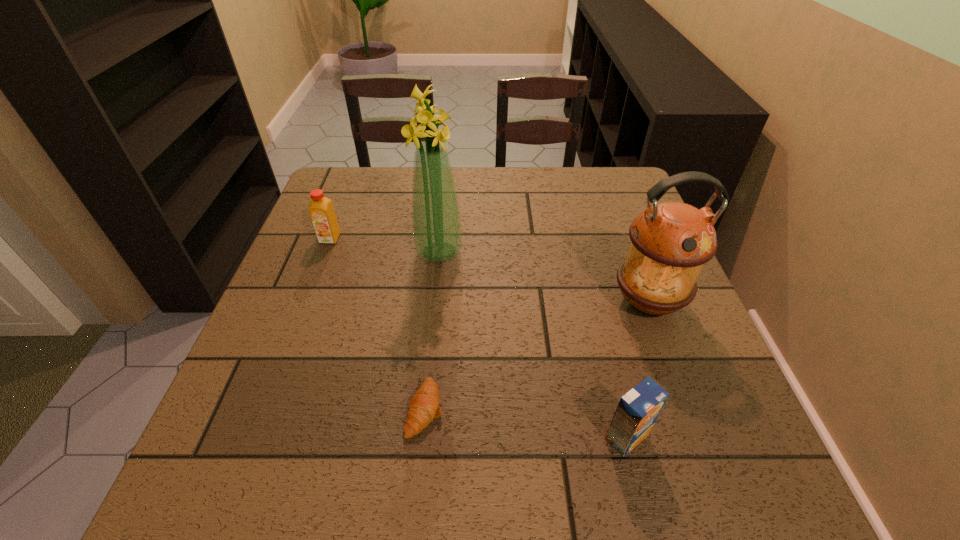
This screenshot has height=540, width=960. In the image, there is a desktop. Identify the location of vacant space at the far right corner. (613, 177).

Where is `free space between the crescent roll and the left orange_juice`? Image resolution: width=960 pixels, height=540 pixels. free space between the crescent roll and the left orange_juice is located at coordinates (377, 324).

Where is `vacant space in between the tallest object and the farther orange_juice`? vacant space in between the tallest object and the farther orange_juice is located at coordinates (385, 246).

At what (x,y) coordinates should I click in order to perform the action: click on vacant space in between the third nearest object and the nearer orange_juice. Please return your answer as a coordinate pair (x, y). The height and width of the screenshot is (540, 960). Looking at the image, I should click on (637, 369).

This screenshot has width=960, height=540. In order to click on vacant area that lies between the oil lamp and the left orange_juice in this screenshot , I will do `click(489, 271)`.

You are a GUI agent. You are given a task and a screenshot of the screen. Output one action in this format:
    pyautogui.click(x=<x>, y=<y>)
    Task: Click on the free space between the crescent roll and the right orange_juice
    The width and height of the screenshot is (960, 540).
    Given the screenshot: What is the action you would take?
    pyautogui.click(x=526, y=423)

This screenshot has width=960, height=540. Find the location of `free space between the tallest object and the farther orange_juice`. free space between the tallest object and the farther orange_juice is located at coordinates (385, 246).

Where is `free space between the fourth shortest object and the crescent roll`? Image resolution: width=960 pixels, height=540 pixels. free space between the fourth shortest object and the crescent roll is located at coordinates (537, 355).

Where is `free space between the oil lamp and the bouquet`? This screenshot has width=960, height=540. free space between the oil lamp and the bouquet is located at coordinates (543, 277).

You are a GUI agent. You are given a task and a screenshot of the screen. Output one action in this format:
    pyautogui.click(x=<x>, y=<y>)
    Task: Click on the empty location between the bouquet and the right orange_juice
    This screenshot has width=960, height=540.
    Given the screenshot: What is the action you would take?
    pyautogui.click(x=533, y=345)